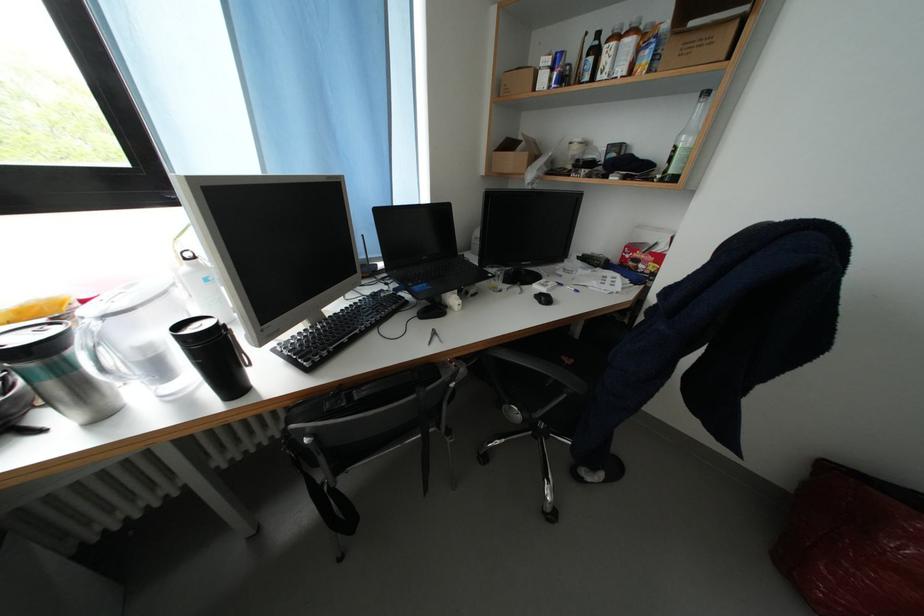
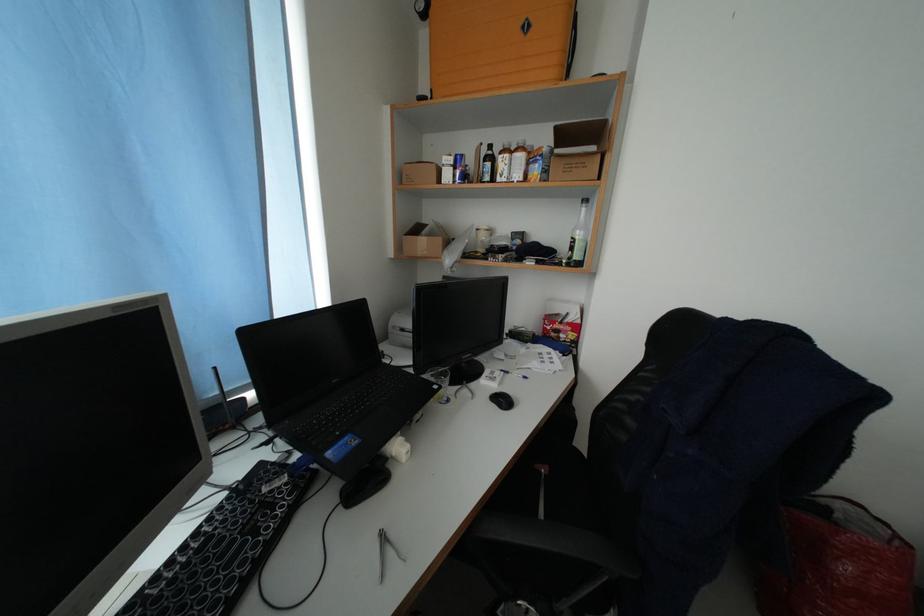
Find the pixel in the second image that matches [561,74] in the first image.

(464, 172)